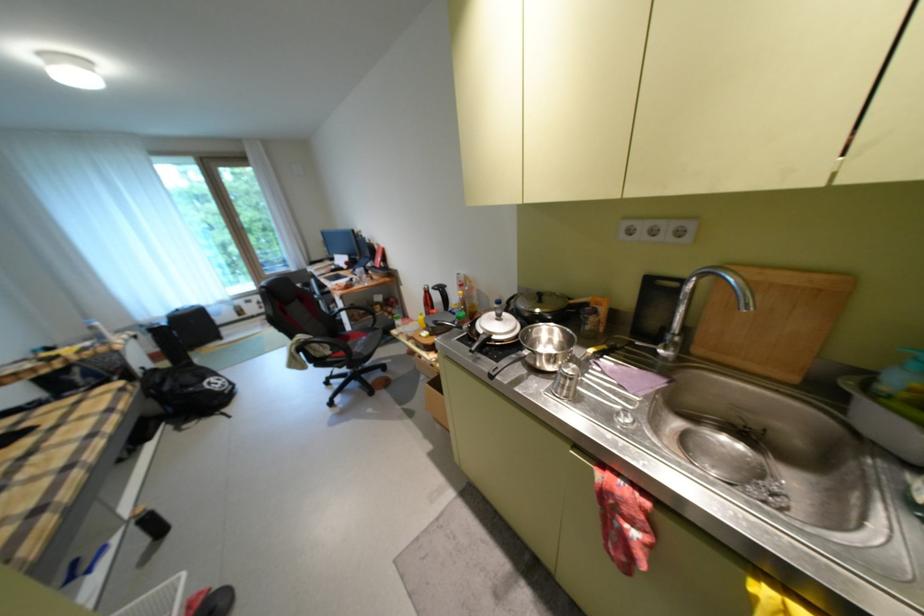
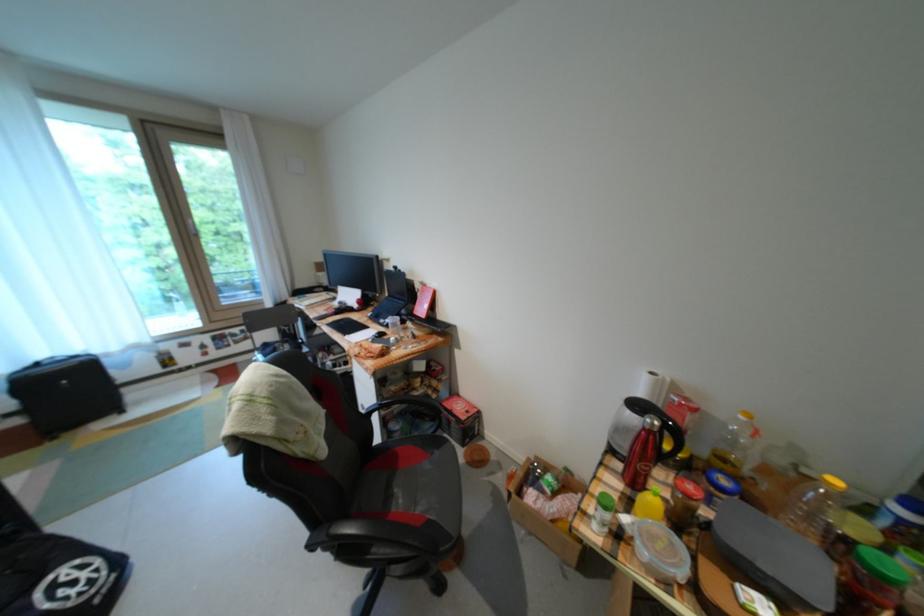
Locate, in the second image, the point that corresponds to pixel 417 339 in the first image.

(664, 582)